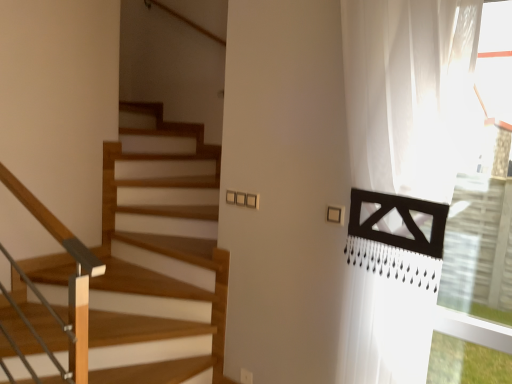
Question: Should I look upward or downward to see white sheer curtain at right?

Choices:
 (A) up
 (B) down

Answer: (B)